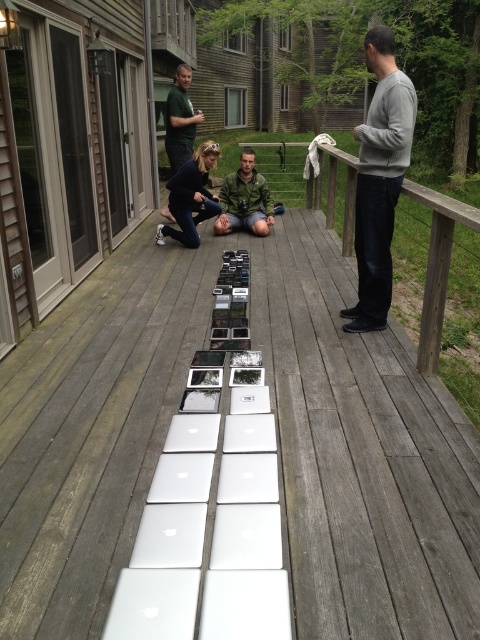
You are organizing a tech event and need to place a new laptop between the gray sweater at center and the green matte jacket at center. According to their positions, which object should the laptop be placed closer to?

The gray sweater at center is located below the green matte jacket at center. Since the gray sweater is below, the laptop should be placed closer to the gray sweater at center to maintain alignment with the lower position.

You are standing on the wooden deck and want to place a new laptop between the wooden at right and the green matte jacket at center. Based on their positions, which object should you place the laptop closer to?

The wooden at right is positioned on the right side of green matte jacket at center, so to place the laptop between them, you should position it closer to the green matte jacket at center since the wooden at right is to its right.

You are standing on the deck and want to place a new laptop between the wooden at right and the matte black jacket at center. Based on their positions, which object should the laptop be closer to?

The wooden at right is to the right of the matte black jacket at center, so placing the laptop between them would require positioning it closer to the matte black jacket at center since the wooden is further to the right.